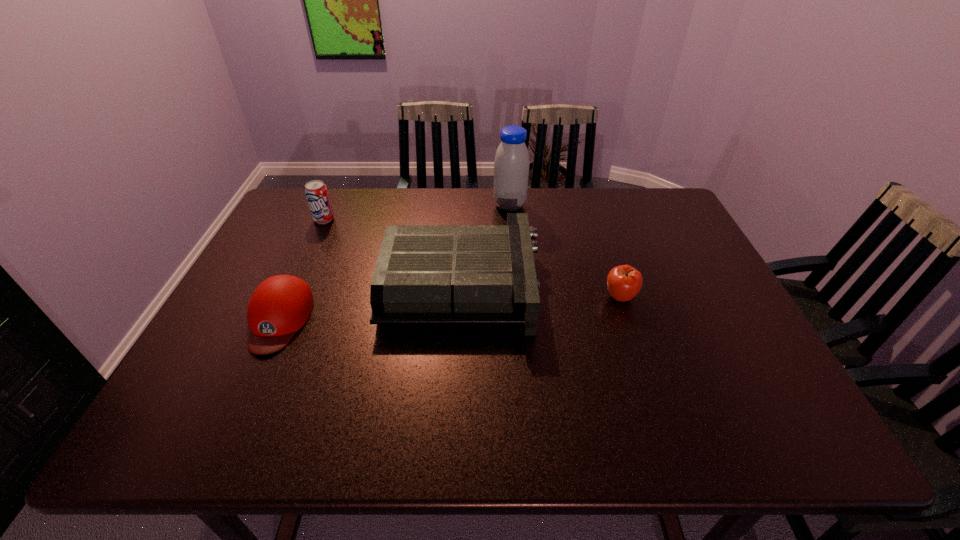
Where is `soya milk positioned at the far edge`? This screenshot has width=960, height=540. soya milk positioned at the far edge is located at coordinates (511, 165).

Find the location of a particular element. This screenshot has height=540, width=960. soda can that is at the far edge is located at coordinates click(316, 192).

Identify the location of soda can at the left edge. The height and width of the screenshot is (540, 960). (316, 192).

Find the location of a particular element. baseball cap positioned at the left edge is located at coordinates (280, 305).

Where is `object that is at the far left corner`? The image size is (960, 540). object that is at the far left corner is located at coordinates (316, 192).

Image resolution: width=960 pixels, height=540 pixels. What are the coordinates of `free space at the far edge` in the screenshot? It's located at (626, 213).

This screenshot has width=960, height=540. I want to click on vacant space at the near edge of the desktop, so click(569, 435).

Identify the location of free spot at the left edge of the desktop. This screenshot has width=960, height=540. (244, 307).

This screenshot has height=540, width=960. In the image, there is a desktop. In order to click on free space at the right edge in this screenshot , I will do `click(717, 308)`.

Image resolution: width=960 pixels, height=540 pixels. I want to click on free space at the far left corner of the desktop, so click(292, 196).